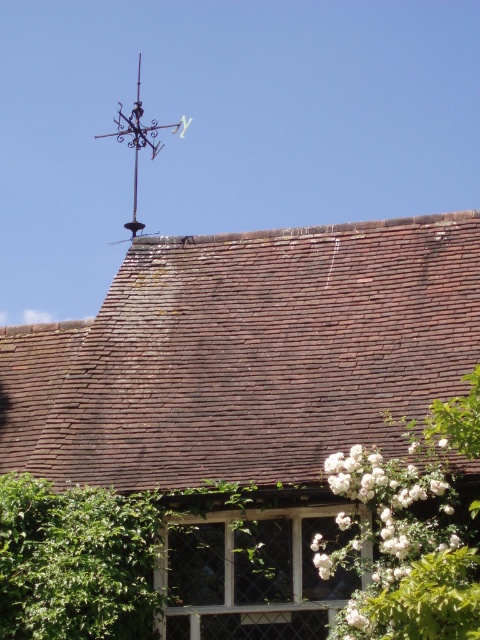
You are a gardener planning to trim the green leafy hedge at lower left and the black wrought iron vane at upper left. Which object requires a wider path for access?

The black wrought iron vane at upper left requires a wider path because its width is greater than the green leafy hedge at lower left.

You are a drone operator who needs to fly a drone from the green leafy hedge at lower left to the brown tile roof at upper center. The drone has a maximum flight range of 15 meters. Based on the scene, will the drone be able to reach the roof?

The brown tile roof at upper center is 17.19 meters from the green leafy hedge at lower left. Since the drone can only fly up to 15 meters, it will not be able to reach the roof.

You are standing in front of the traditional building and want to take a photo. You notice two points on the roof marked as point 1 at coordinates (300, 413) and point 2 at (134, 205). Which point is closer to your camera lens when taking the photo?

Point 1 at coordinates (300, 413) is closer to the camera lens than point 2 at (134, 205).